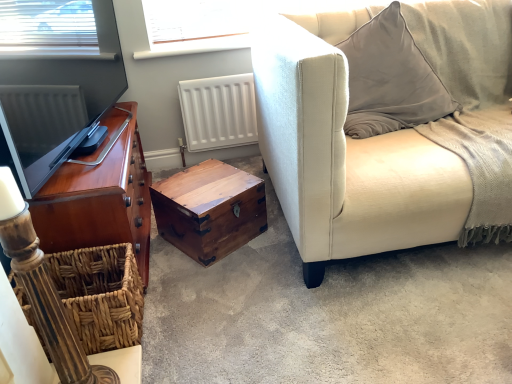
Question: Does shiny brown wood cabinet at left have a lesser width compared to suede beige couch at right?

Choices:
 (A) yes
 (B) no

Answer: (A)

Question: From a real-world perspective, is shiny brown wood cabinet at left physically below suede beige couch at right?

Choices:
 (A) yes
 (B) no

Answer: (A)

Question: Does shiny brown wood cabinet at left have a smaller size compared to suede beige couch at right?

Choices:
 (A) yes
 (B) no

Answer: (A)

Question: Is shiny brown wood cabinet at left positioned with its back to suede beige couch at right?

Choices:
 (A) no
 (B) yes

Answer: (A)

Question: Is shiny brown wood cabinet at left at the right side of suede beige couch at right?

Choices:
 (A) yes
 (B) no

Answer: (B)

Question: Is shiny brown wood cabinet at left taller than suede beige couch at right?

Choices:
 (A) no
 (B) yes

Answer: (A)

Question: Does woven brown basket at lower left contain wooden trunk at center?

Choices:
 (A) yes
 (B) no

Answer: (B)

Question: Are woven brown basket at lower left and wooden trunk at center far apart?

Choices:
 (A) yes
 (B) no

Answer: (B)

Question: From the image's perspective, does woven brown basket at lower left appear higher than wooden trunk at center?

Choices:
 (A) yes
 (B) no

Answer: (B)

Question: Is woven brown basket at lower left wider than wooden trunk at center?

Choices:
 (A) yes
 (B) no

Answer: (B)

Question: Is woven brown basket at lower left further to the viewer compared to wooden trunk at center?

Choices:
 (A) yes
 (B) no

Answer: (A)

Question: From a real-world perspective, does woven brown basket at lower left sit lower than wooden trunk at center?

Choices:
 (A) yes
 (B) no

Answer: (B)

Question: From the image's perspective, is woven brown basket at lower left located beneath shiny brown wood cabinet at left?

Choices:
 (A) no
 (B) yes

Answer: (B)